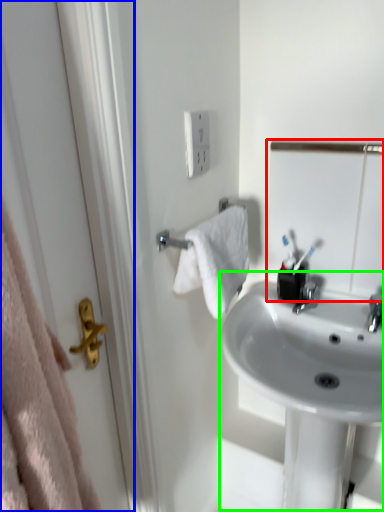
Question: Which object is the farthest from mirror (highlighted by a red box)? Choose among these: screen door (highlighted by a blue box) or sink (highlighted by a green box).

Choices:
 (A) screen door
 (B) sink

Answer: (A)